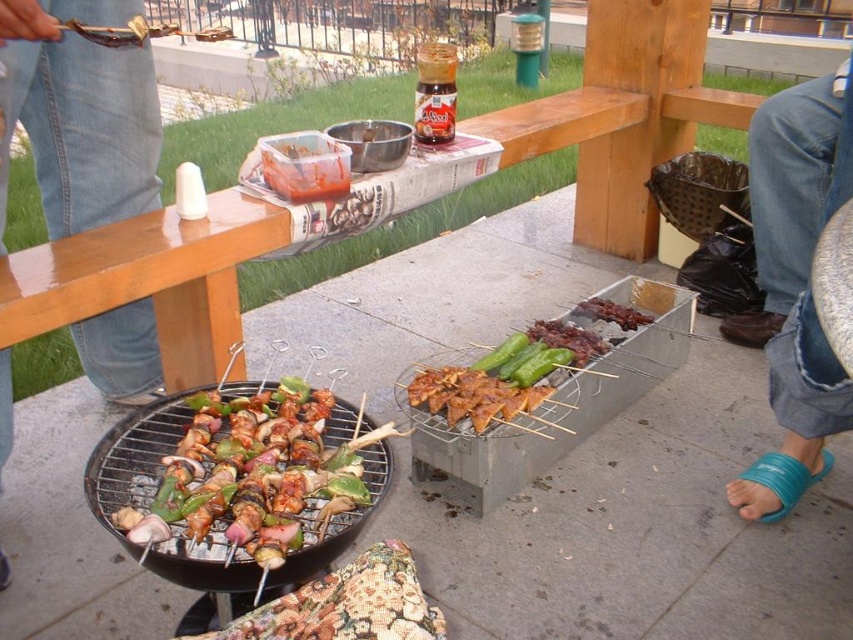
In order to click on grilled skewers at center in this screenshot , I will do `click(236, 476)`.

Who is positioned more to the left, grilled skewers at center or charred wooden skewers at center?

From the viewer's perspective, grilled skewers at center appears more on the left side.

Is point (134, 435) positioned behind point (546, 372)?

No.

I want to click on grilled skewers at center, so click(236, 476).

Is grilled skewers at center positioned at the back of charred meat skewers at center?

That is False.

Which is in front, point (306, 548) or point (622, 328)?

Point (306, 548) is in front.

This screenshot has height=640, width=853. In order to click on grilled skewers at center in this screenshot , I will do `click(236, 476)`.

Is blue rubber sandals at lower right closer to the viewer compared to charred meat skewers at center?

Yes, blue rubber sandals at lower right is closer to the viewer.

Measure the distance from blue rubber sandals at lower right to charred meat skewers at center.

blue rubber sandals at lower right and charred meat skewers at center are 20.58 inches apart.

Describe the element at coordinates (795, 284) in the screenshot. The height and width of the screenshot is (640, 853). I see `blue rubber sandals at lower right` at that location.

At what (x,y) coordinates should I click in order to perform the action: click on blue rubber sandals at lower right. Please return your answer as a coordinate pair (x, y). Looking at the image, I should click on coord(795,284).